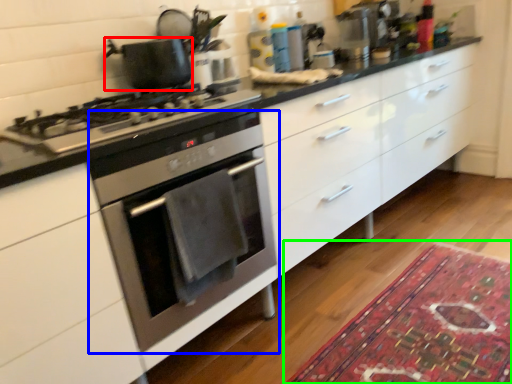
Question: Based on their relative distances, which object is nearer to kitchen appliance (highlighted by a red box)? Choose from oven (highlighted by a blue box) and mat (highlighted by a green box).

Choices:
 (A) oven
 (B) mat

Answer: (A)